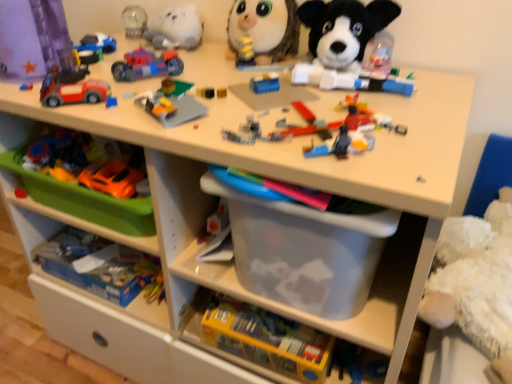
Where is `vacant area that is in front of translucent plastic motorcycle at upper center, which ranks as the 6th toy in bottom-to-top order`? The width and height of the screenshot is (512, 384). vacant area that is in front of translucent plastic motorcycle at upper center, which ranks as the 6th toy in bottom-to-top order is located at coordinates (140, 98).